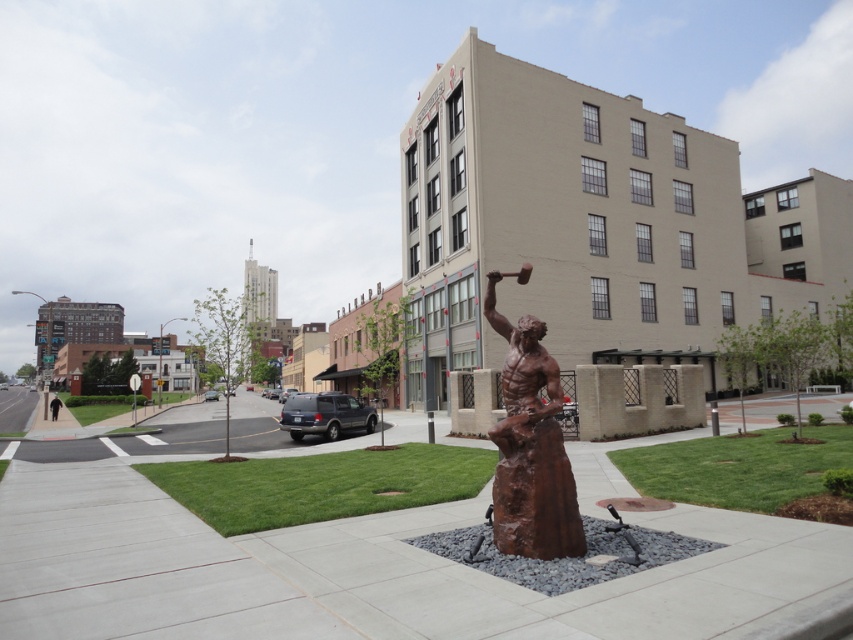
You are a delivery person trying to park your 1.5 meter wide cart. You see the smooth concrete pavement at center and the black fabric person at lower left. Which area can accommodate your cart in terms of width?

The smooth concrete pavement at center has a width that surpasses the black fabric person at lower left, so the cart can fit on the smooth concrete pavement at center since it is wider than the black fabric person at lower left.

You are standing at the entrance of the beige building to the right of the sculpture. You need to walk directly towards the rusty bronze statue at center. Which direction should you turn to face the statue?

Since the rusty bronze statue at center is located at point (531, 448), you should turn to face the center of the image where the statue is positioned.

You are standing in front of the sculpture and want to walk towards the black fabric person at lower left. Which direction should you move relative to the smooth concrete pavement at center?

Since the smooth concrete pavement at center is closer to the viewer than the black fabric person at lower left, you should move away from the smooth concrete pavement at center to reach the black fabric person at lower left.